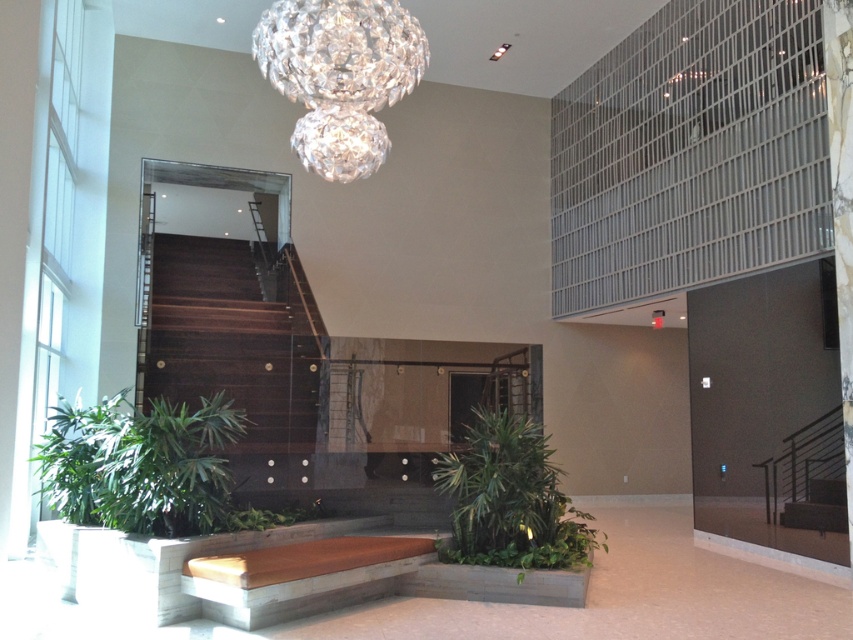
Question: Estimate the real-world distances between objects in this image. Which object is farther from the green leafy plant at center?

Choices:
 (A) crystal glass chandelier at upper center
 (B) green leafy plant at lower left

Answer: (A)

Question: Does crystal glass chandelier at upper center appear on the right side of green leafy plant at center?

Choices:
 (A) no
 (B) yes

Answer: (A)

Question: Based on their relative distances, which object is farther from the crystal glass chandelier at upper center?

Choices:
 (A) green leafy plant at center
 (B) green leafy plant at lower left

Answer: (A)

Question: Is green leafy plant at lower left to the right of crystal glass chandelier at upper center from the viewer's perspective?

Choices:
 (A) no
 (B) yes

Answer: (A)

Question: Is crystal glass chandelier at upper center to the left of green leafy plant at center from the viewer's perspective?

Choices:
 (A) no
 (B) yes

Answer: (B)

Question: Among these points, which one is nearest to the camera?

Choices:
 (A) (462, 499)
 (B) (112, 520)

Answer: (B)